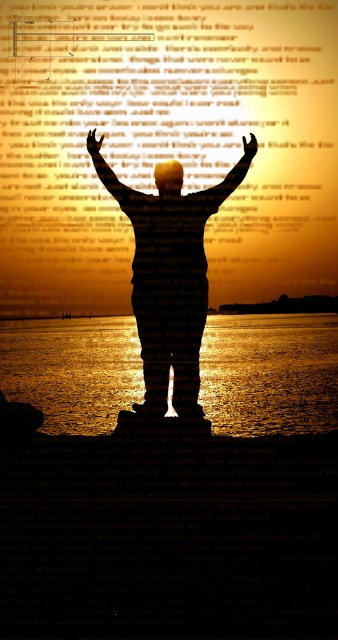
Is point (192, 193) less distant than point (92, 140)?

Yes.

Does matte gold arm at upper center have a larger size compared to matte black hand at center?

Correct, matte gold arm at upper center is larger in size than matte black hand at center.

Is point (237, 179) positioned behind point (97, 145)?

No.

Find the location of a particular element. The image size is (338, 640). matte gold arm at upper center is located at coordinates (222, 184).

Is point (110, 189) farther from viewer compared to point (155, 180)?

That is False.

Is point (105, 161) more distant than point (174, 193)?

No.

Find the location of a particular element. silhouette arm at center is located at coordinates (115, 180).

Which of these two, golden reflective water at center or matte gold hand at upper center, stands shorter?

matte gold hand at upper center

Can you confirm if golden reflective water at center is positioned below matte gold hand at upper center?

Indeed, golden reflective water at center is positioned under matte gold hand at upper center.

Describe the element at coordinates (270, 372) in the screenshot. I see `golden reflective water at center` at that location.

Locate an element on the screen. The width and height of the screenshot is (338, 640). golden reflective water at center is located at coordinates (270, 372).